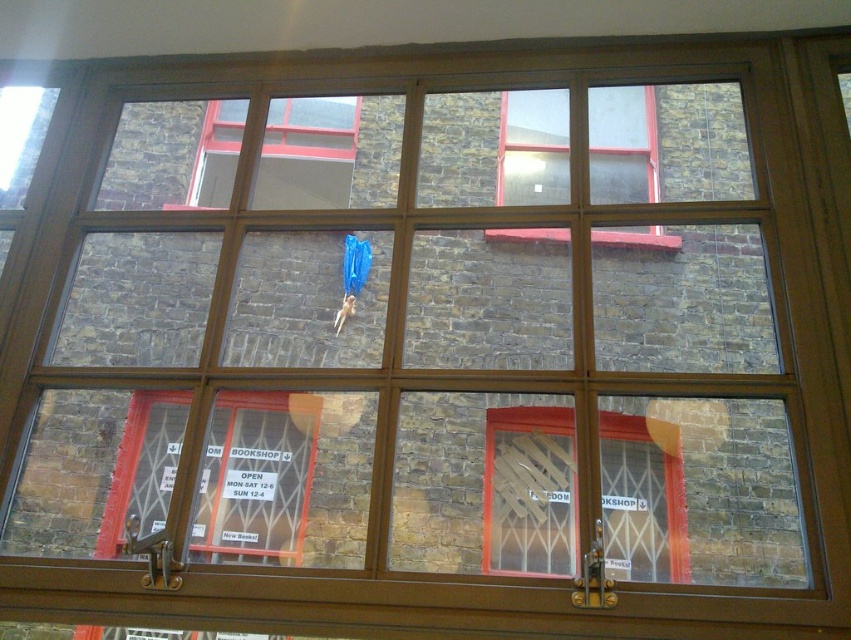
Does point (617, 426) come behind point (547, 184)?

Yes, it is.

Which is above, clear glass window at center or clear glass window at upper center?

clear glass window at upper center is above.

The height and width of the screenshot is (640, 851). What are the coordinates of `clear glass window at center` in the screenshot? It's located at (530, 492).

Between point (652, 166) and point (283, 109), which one is positioned in front?

Point (652, 166) is in front.

Is clear glass window at upper center shorter than matte glass window at upper left?

No.

Is point (532, 200) less distant than point (277, 177)?

That is True.

The image size is (851, 640). Identify the location of clear glass window at upper center. (621, 147).

Consider the image. Is clear glass window at center positioned before matte glass window at upper left?

Yes, clear glass window at center is closer to the viewer.

Can you confirm if clear glass window at center is shorter than matte glass window at upper left?

No, clear glass window at center is not shorter than matte glass window at upper left.

Does point (570, 540) come in front of point (312, 196)?

Yes, it is in front of point (312, 196).

Identify the location of clear glass window at center. (530, 492).